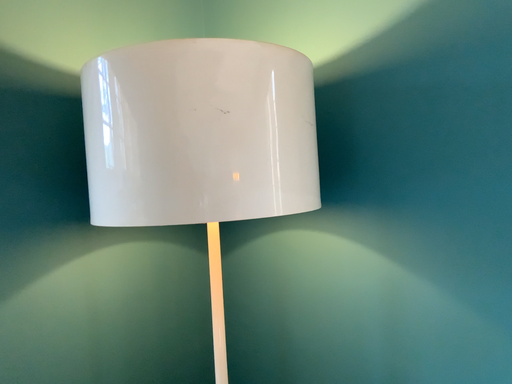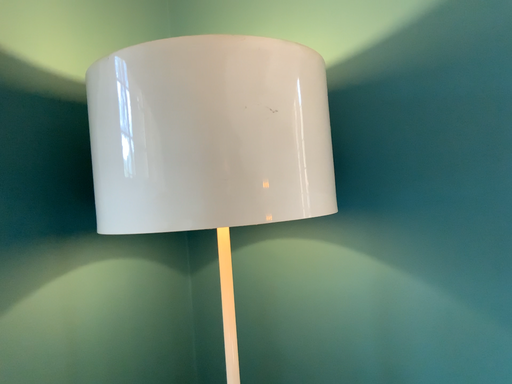
Question: How did the camera likely rotate when shooting the video?

Choices:
 (A) rotated right
 (B) rotated left

Answer: (A)